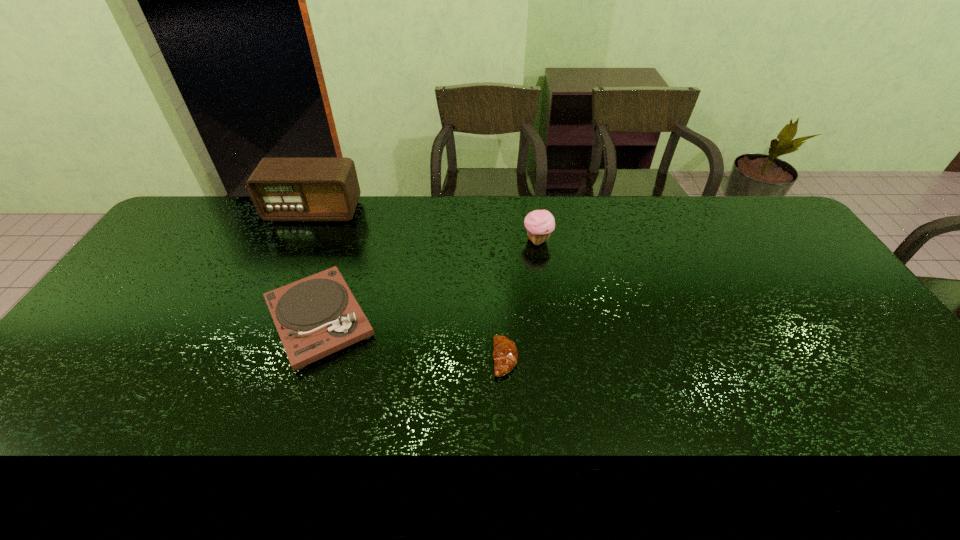
I want to click on vacant area that satisfies the following two spatial constraints: 1. on the front-facing side of the radio receiver; 2. on the left side of the phonograph_record, so click(x=266, y=319).

The width and height of the screenshot is (960, 540). Identify the location of free point that satisfies the following two spatial constraints: 1. on the front-facing side of the third tallest object; 2. on the right side of the radio receiver. (266, 319).

You are a GUI agent. You are given a task and a screenshot of the screen. Output one action in this format:
    pyautogui.click(x=<x>, y=<y>)
    Task: Click on the free location that satisfies the following two spatial constraints: 1. on the front-facing side of the crescent roll; 2. on the right side of the farthest object
    
    Given the screenshot: What is the action you would take?
    pyautogui.click(x=249, y=359)

The width and height of the screenshot is (960, 540). Find the location of `free location that satisfies the following two spatial constraints: 1. on the front-facing side of the farthest object; 2. on the right side of the shortest object`. free location that satisfies the following two spatial constraints: 1. on the front-facing side of the farthest object; 2. on the right side of the shortest object is located at coordinates (249, 359).

I want to click on vacant position in the image that satisfies the following two spatial constraints: 1. on the front-facing side of the third tallest object; 2. on the left side of the radio receiver, so click(266, 319).